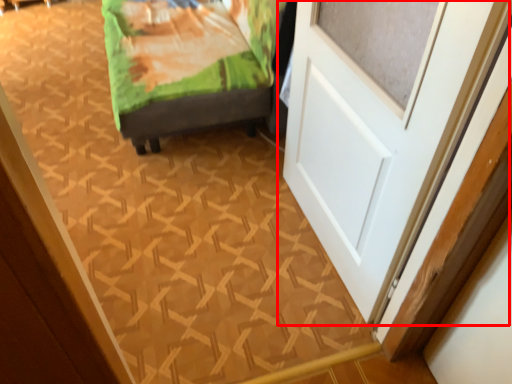
Question: From the image's perspective, considering the relative positions of door (annotated by the red box) and furniture in the image provided, where is door (annotated by the red box) located with respect to the staircase?

Choices:
 (A) above
 (B) below

Answer: (B)